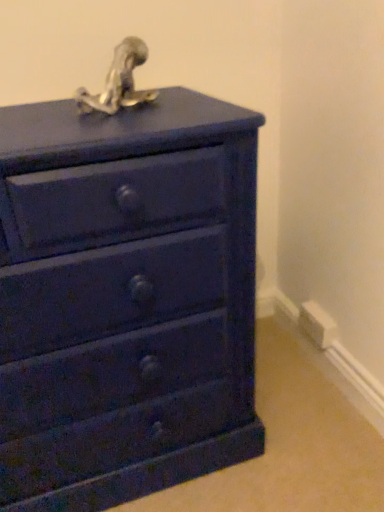
Where is `metallic silver sculpture at top`? metallic silver sculpture at top is located at coordinates (119, 81).

Measure the distance between metallic silver sculpture at top and camera.

metallic silver sculpture at top and camera are 34.30 inches apart from each other.

Measure the distance between point (308, 314) and camera.

Point (308, 314) is 1.54 meters from camera.

At what (x,y) coordinates should I click in order to perform the action: click on matte blue chest of drawers at center. Please return your answer as a coordinate pair (x, y). This screenshot has height=512, width=384. Looking at the image, I should click on (125, 298).

From the image's perspective, who appears lower, white plastic electric outlet at lower right or matte blue chest of drawers at center?

white plastic electric outlet at lower right appears lower in the image.

Considering the relative sizes of white plastic electric outlet at lower right and matte blue chest of drawers at center in the image provided, is white plastic electric outlet at lower right wider than matte blue chest of drawers at center?

Incorrect, the width of white plastic electric outlet at lower right does not surpass that of matte blue chest of drawers at center.

From a real-world perspective, is white plastic electric outlet at lower right above or below matte blue chest of drawers at center?

Clearly, from a real-world perspective, white plastic electric outlet at lower right is below matte blue chest of drawers at center.

Is white plastic electric outlet at lower right surrounded by matte blue chest of drawers at center?

No, white plastic electric outlet at lower right is located outside of matte blue chest of drawers at center.

Which object is closer to the camera taking this photo, matte blue chest of drawers at center or white plastic electric outlet at lower right?

matte blue chest of drawers at center is more forward.

Is the surface of matte blue chest of drawers at center in direct contact with white plastic electric outlet at lower right?

No, matte blue chest of drawers at center is not beside white plastic electric outlet at lower right.

From the image's perspective, relative to white plastic electric outlet at lower right, is matte blue chest of drawers at center above or below?

matte blue chest of drawers at center is above white plastic electric outlet at lower right.

Considering the positions of objects matte blue chest of drawers at center and metallic silver sculpture at top in the image provided, who is more to the left, matte blue chest of drawers at center or metallic silver sculpture at top?

Positioned to the left is matte blue chest of drawers at center.

Measure the distance between matte blue chest of drawers at center and metallic silver sculpture at top.

They are 16.98 inches apart.

Does point (138, 279) come in front of point (116, 81)?

Yes, it is in front of point (116, 81).

Which of these two, matte blue chest of drawers at center or metallic silver sculpture at top, is smaller?

metallic silver sculpture at top.

Can you confirm if metallic silver sculpture at top is smaller than white plastic electric outlet at lower right?

No, metallic silver sculpture at top is not smaller than white plastic electric outlet at lower right.

From the image's perspective, which object appears higher, metallic silver sculpture at top or white plastic electric outlet at lower right?

metallic silver sculpture at top is shown above in the image.

In the scene shown: Is metallic silver sculpture at top surrounding white plastic electric outlet at lower right?

No, white plastic electric outlet at lower right is located outside of metallic silver sculpture at top.

Locate an element on the screen. This screenshot has width=384, height=512. sculpture on the left of white plastic electric outlet at lower right is located at coordinates [119, 81].

Which is more to the right, white plastic electric outlet at lower right or metallic silver sculpture at top?

Positioned to the right is white plastic electric outlet at lower right.

Looking at this image, which object is thinner, white plastic electric outlet at lower right or metallic silver sculpture at top?

Thinner between the two is white plastic electric outlet at lower right.

From a real-world perspective, who is located lower, white plastic electric outlet at lower right or metallic silver sculpture at top?

white plastic electric outlet at lower right, from a real-world perspective.

Is metallic silver sculpture at top at the back of white plastic electric outlet at lower right?

No, white plastic electric outlet at lower right's orientation is not away from metallic silver sculpture at top.

Consider the image. From a real-world perspective, does metallic silver sculpture at top stand above matte blue chest of drawers at center?

Yes, from a real-world perspective, metallic silver sculpture at top is over matte blue chest of drawers at center

Would you say metallic silver sculpture at top contains matte blue chest of drawers at center?

Definitely not — matte blue chest of drawers at center is not inside metallic silver sculpture at top.

Identify the location of chest of drawers that appears on the left of metallic silver sculpture at top. (125, 298).

You are a GUI agent. You are given a task and a screenshot of the screen. Output one action in this format:
    pyautogui.click(x=<x>, y=<y>)
    Task: Click on the chest of drawers above the white plastic electric outlet at lower right (from the image's perspective)
    Image resolution: width=384 pixels, height=512 pixels.
    Given the screenshot: What is the action you would take?
    pyautogui.click(x=125, y=298)

At what (x,y) coordinates should I click in order to perform the action: click on electric outlet located behind the matte blue chest of drawers at center. Please return your answer as a coordinate pair (x, y). Looking at the image, I should click on (317, 324).

Looking at the image, which one is located closer to white plastic electric outlet at lower right, metallic silver sculpture at top or matte blue chest of drawers at center?

matte blue chest of drawers at center is positioned closer to the anchor white plastic electric outlet at lower right.

Looking at the image, which one is located closer to matte blue chest of drawers at center, metallic silver sculpture at top or white plastic electric outlet at lower right?

metallic silver sculpture at top lies closer to matte blue chest of drawers at center than the other object.

Considering their positions, is white plastic electric outlet at lower right positioned closer to metallic silver sculpture at top than matte blue chest of drawers at center?

matte blue chest of drawers at center.

Which object lies nearer to the anchor point matte blue chest of drawers at center, white plastic electric outlet at lower right or metallic silver sculpture at top?

metallic silver sculpture at top is closer to matte blue chest of drawers at center.

In the scene shown: Considering their positions, is matte blue chest of drawers at center positioned closer to white plastic electric outlet at lower right than metallic silver sculpture at top?

matte blue chest of drawers at center is closer to white plastic electric outlet at lower right.

Considering their positions, is matte blue chest of drawers at center positioned closer to metallic silver sculpture at top than white plastic electric outlet at lower right?

matte blue chest of drawers at center.

Where is `sculpture between matte blue chest of drawers at center and white plastic electric outlet at lower right in the front-back direction`? This screenshot has width=384, height=512. sculpture between matte blue chest of drawers at center and white plastic electric outlet at lower right in the front-back direction is located at coordinates pos(119,81).